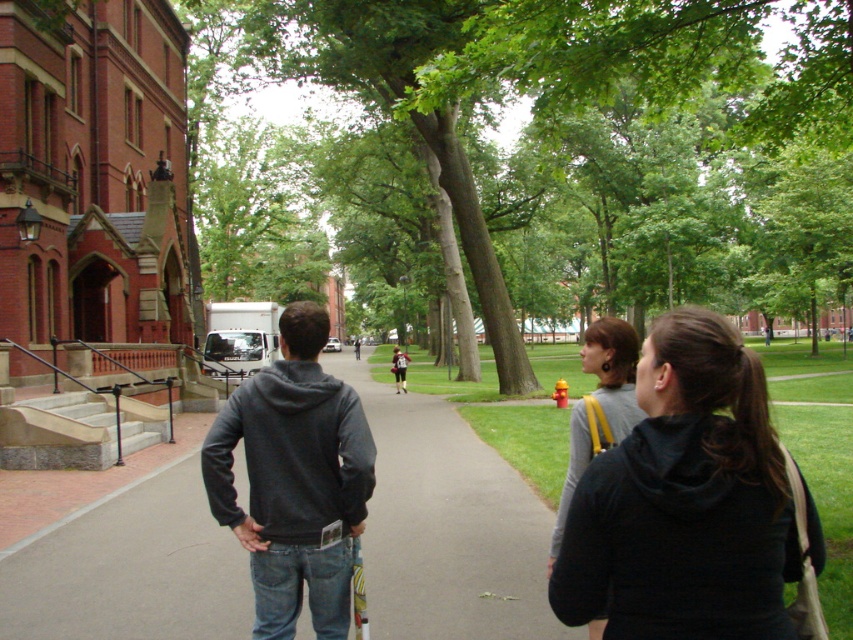
Question: Estimate the real-world distances between objects in this image. Which object is farther from the gray asphalt pavement at center?

Choices:
 (A) gray hoodie at center
 (B) gray fabric backpack at center right
 (C) dark gray hoodie at center
 (D) green leafy tree at center

Answer: (D)

Question: Which point is farther to the camera?

Choices:
 (A) (781, 609)
 (B) (283, 364)
 (C) (521, 540)

Answer: (C)

Question: Does green leafy tree at center appear on the left side of dark gray hoodie at center?

Choices:
 (A) no
 (B) yes

Answer: (A)

Question: Can you confirm if green leafy tree at center is positioned above gray hoodie at center?

Choices:
 (A) no
 (B) yes

Answer: (B)

Question: Which of the following is the farthest from the observer?

Choices:
 (A) gray fabric backpack at center right
 (B) gray asphalt pavement at center
 (C) green leafy tree at center

Answer: (C)

Question: Does green leafy tree at center appear over dark gray hoodie at center?

Choices:
 (A) no
 (B) yes

Answer: (B)